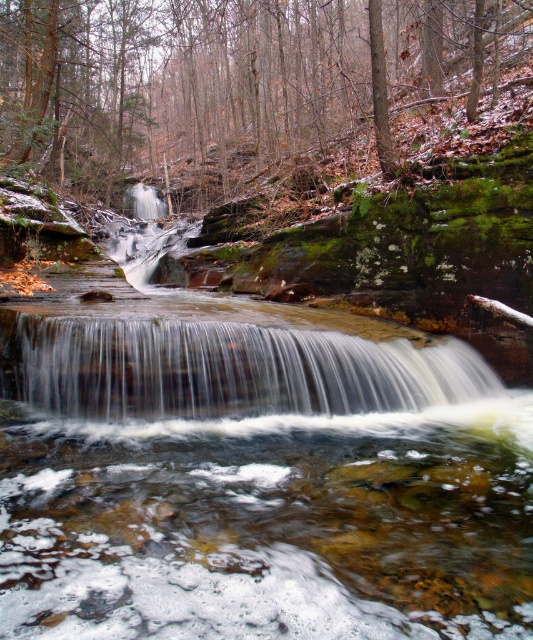
Question: Does green mossy rocks at center have a larger size compared to white frothy water at center?

Choices:
 (A) yes
 (B) no

Answer: (A)

Question: Which of the following is the closest to the observer?

Choices:
 (A) (377, 381)
 (B) (286, 17)

Answer: (A)

Question: Can you confirm if green mossy rocks at center is positioned below white frothy water at center?

Choices:
 (A) no
 (B) yes

Answer: (A)

Question: Can you confirm if green mossy rocks at center is smaller than white frothy water at center?

Choices:
 (A) no
 (B) yes

Answer: (A)

Question: Which of the following is the closest to the observer?

Choices:
 (A) (269, 136)
 (B) (282, 410)

Answer: (B)